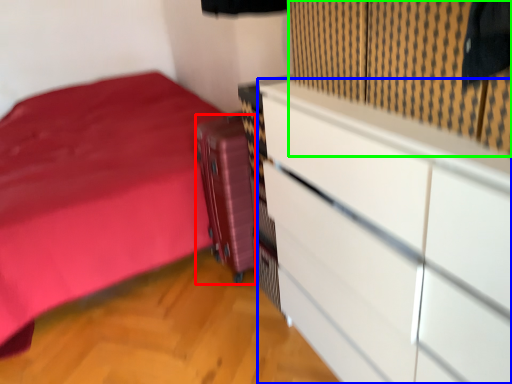
Question: Considering the real-world distances, which object is farthest from luggage (highlighted by a red box)? chest of drawers (highlighted by a blue box) or curtain (highlighted by a green box)?

Choices:
 (A) chest of drawers
 (B) curtain

Answer: (B)